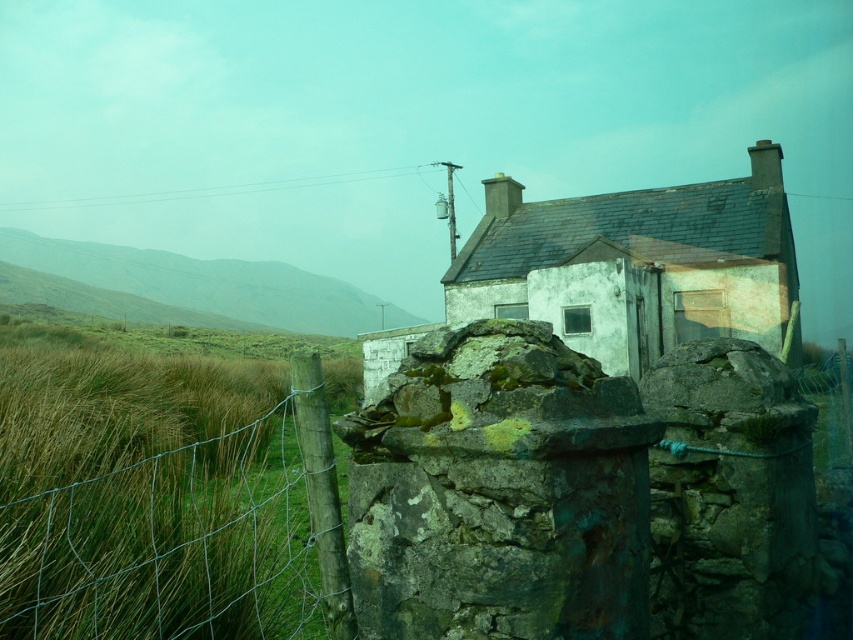
You are standing in front of the stone house and notice a point marked at coordinates (149,499). Based on the scene description, what object is located at that position?

The point at coordinates (149,499) corresponds to the green wire fence at left.

You are a photographer planning to capture the white stone cottage at center and the green grassy hillside at left in a single wide shot. Which object will appear narrower in the photograph?

The white stone cottage at center will appear narrower in the photograph because it is thinner than the green grassy hillside at left.

You are standing in front of the stone house and notice the green wire fence at left and the green grassy hillside at left. From your current position, which object is closer to you?

The green wire fence at left is closer because it is in front of the green grassy hillside at left.